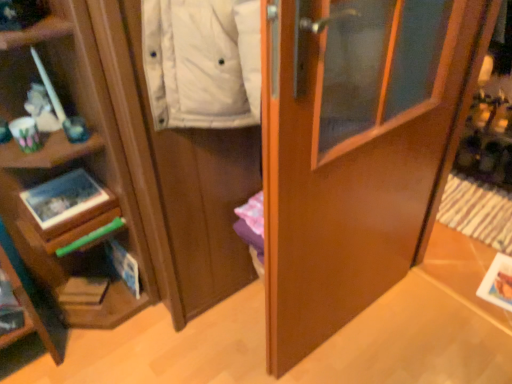
Question: Is matte cardboard magazine at lower left in front of glossy wood door at center?

Choices:
 (A) yes
 (B) no

Answer: (B)

Question: Is matte cardboard magazine at lower left thinner than glossy wood door at center?

Choices:
 (A) no
 (B) yes

Answer: (B)

Question: Is matte cardboard magazine at lower left wider than glossy wood door at center?

Choices:
 (A) no
 (B) yes

Answer: (A)

Question: Are matte cardboard magazine at lower left and glossy wood door at center beside each other?

Choices:
 (A) no
 (B) yes

Answer: (A)

Question: Is matte cardboard magazine at lower left positioned beyond the bounds of glossy wood door at center?

Choices:
 (A) no
 (B) yes

Answer: (B)

Question: Can you confirm if matte cardboard magazine at lower left is taller than glossy wood door at center?

Choices:
 (A) no
 (B) yes

Answer: (A)

Question: Can you confirm if matte wood cabinet at left is smaller than matte cardboard magazine at lower left?

Choices:
 (A) yes
 (B) no

Answer: (B)

Question: Are matte wood cabinet at left and matte cardboard magazine at lower left located far from each other?

Choices:
 (A) yes
 (B) no

Answer: (B)

Question: Is matte wood cabinet at left located outside matte cardboard magazine at lower left?

Choices:
 (A) yes
 (B) no

Answer: (A)

Question: Does matte wood cabinet at left appear on the right side of matte cardboard magazine at lower left?

Choices:
 (A) yes
 (B) no

Answer: (A)

Question: From the image's perspective, is matte wood cabinet at left on top of matte cardboard magazine at lower left?

Choices:
 (A) yes
 (B) no

Answer: (A)

Question: Considering the relative positions of matte wood cabinet at left and matte cardboard magazine at lower left in the image provided, is matte wood cabinet at left behind matte cardboard magazine at lower left?

Choices:
 (A) yes
 (B) no

Answer: (B)

Question: From a real-world perspective, is glossy wood door at center on top of matte wood cabinet at left?

Choices:
 (A) yes
 (B) no

Answer: (A)